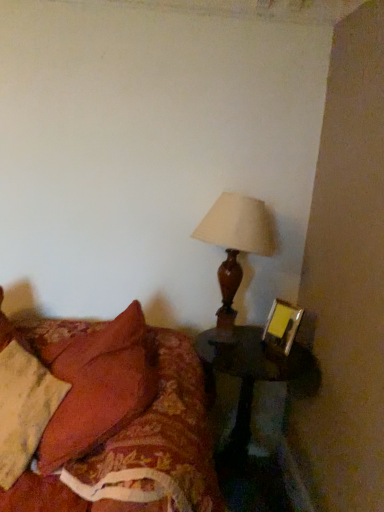
The width and height of the screenshot is (384, 512). In order to click on floral fabric bed at lower left in this screenshot , I will do `click(103, 419)`.

What do you see at coordinates (103, 419) in the screenshot?
I see `floral fabric bed at lower left` at bounding box center [103, 419].

Locate an element on the screen. The height and width of the screenshot is (512, 384). black wood side table at lower right is located at coordinates (252, 386).

Is floral fabric bed at lower left oriented away from velvet red pillow at lower left?

That's right, floral fabric bed at lower left is facing away from velvet red pillow at lower left.

Is floral fabric bed at lower left thinner than velvet red pillow at lower left?

In fact, floral fabric bed at lower left might be wider than velvet red pillow at lower left.

Is floral fabric bed at lower left spatially inside velvet red pillow at lower left, or outside of it?

floral fabric bed at lower left is located beyond the bounds of velvet red pillow at lower left.

Is floral fabric bed at lower left behind velvet red pillow at lower left?

No, the depth of floral fabric bed at lower left is less than that of velvet red pillow at lower left.

Considering the relative positions of velvet red pillow at lower left and matte brown lamp at upper right in the image provided, is velvet red pillow at lower left to the left or to the right of matte brown lamp at upper right?

Clearly, velvet red pillow at lower left is on the left of matte brown lamp at upper right in the image.

From the picture: From a real-world perspective, is velvet red pillow at lower left physically located above or below matte brown lamp at upper right?

velvet red pillow at lower left is situated lower than matte brown lamp at upper right in the real world.

Do you think velvet red pillow at lower left is within matte brown lamp at upper right, or outside of it?

The correct answer is: outside.

Which is behind, velvet red pillow at lower left or matte brown lamp at upper right?

matte brown lamp at upper right is further from the camera.

Which is more to the right, matte brown lamp at upper right or floral fabric bed at lower left?

Positioned to the right is matte brown lamp at upper right.

Which of these two, matte brown lamp at upper right or floral fabric bed at lower left, stands shorter?

Standing shorter between the two is floral fabric bed at lower left.

Does matte brown lamp at upper right have a smaller size compared to floral fabric bed at lower left?

Yes, matte brown lamp at upper right is smaller than floral fabric bed at lower left.

From the image's perspective, between matte brown lamp at upper right and floral fabric bed at lower left, which one is located above?

matte brown lamp at upper right, from the image's perspective.

Is floral fabric bed at lower left in contact with matte brown lamp at upper right?

No, floral fabric bed at lower left is not beside matte brown lamp at upper right.

From the image's perspective, is floral fabric bed at lower left over matte brown lamp at upper right?

No, from the image's perspective, floral fabric bed at lower left is not on top of matte brown lamp at upper right.

Is floral fabric bed at lower left wider than matte brown lamp at upper right?

Indeed, floral fabric bed at lower left has a greater width compared to matte brown lamp at upper right.

From a real-world perspective, which is physically above, floral fabric bed at lower left or matte brown lamp at upper right?

In real-world perspective, matte brown lamp at upper right is above.

Considering the relative sizes of floral fabric bed at lower left and black wood side table at lower right in the image provided, is floral fabric bed at lower left smaller than black wood side table at lower right?

Incorrect, floral fabric bed at lower left is not smaller in size than black wood side table at lower right.

Is floral fabric bed at lower left oriented away from black wood side table at lower right?

That's right, floral fabric bed at lower left is facing away from black wood side table at lower right.

Which is closer, [184,479] or [242,356]?

Positioned in front is point [184,479].

From the image's perspective, between floral fabric bed at lower left and black wood side table at lower right, who is located below?

black wood side table at lower right is shown below in the image.

From the image's perspective, is velvet red pillow at lower left located above or below matte gold picture frame at right?

Clearly, from the image's perspective, velvet red pillow at lower left is below matte gold picture frame at right.

From a real-world perspective, is velvet red pillow at lower left physically located above or below matte gold picture frame at right?

velvet red pillow at lower left is situated lower than matte gold picture frame at right in the real world.

Considering the relative sizes of velvet red pillow at lower left and matte gold picture frame at right in the image provided, is velvet red pillow at lower left shorter than matte gold picture frame at right?

In fact, velvet red pillow at lower left may be taller than matte gold picture frame at right.

Measure the distance from velvet red pillow at lower left to matte gold picture frame at right.

37.42 inches.

Is the surface of black wood side table at lower right in direct contact with matte brown lamp at upper right?

There is a gap between black wood side table at lower right and matte brown lamp at upper right.

From the image's perspective, which is above, black wood side table at lower right or matte brown lamp at upper right?

From the image's view, matte brown lamp at upper right is above.

Looking at this image, between black wood side table at lower right and matte brown lamp at upper right, which one is positioned behind?

matte brown lamp at upper right is more distant.

Does point (283, 422) appear closer or farther from the camera than point (221, 313)?

Point (283, 422).

In order to click on pillow beneath the floral fabric bed at lower left (from a real-world perspective) in this screenshot , I will do `click(24, 408)`.

The height and width of the screenshot is (512, 384). I want to click on lamp located above the velvet red pillow at lower left (from the image's perspective), so click(x=235, y=248).

Based on their spatial positions, is matte gold picture frame at right or floral fabric bed at lower left further from black wood side table at lower right?

floral fabric bed at lower left is positioned further to the anchor black wood side table at lower right.

Looking at the image, which one is located closer to black wood side table at lower right, floral fabric bed at lower left or matte brown lamp at upper right?

The object closer to black wood side table at lower right is matte brown lamp at upper right.

Based on their spatial positions, is black wood side table at lower right or matte gold picture frame at right further from velvet red pillow at lower left?

matte gold picture frame at right lies further to velvet red pillow at lower left than the other object.

Based on their spatial positions, is floral fabric bed at lower left or matte brown lamp at upper right closer to matte gold picture frame at right?

Based on the image, matte brown lamp at upper right appears to be nearer to matte gold picture frame at right.

Based on the photo, which object lies further to the anchor point black wood side table at lower right, floral fabric bed at lower left or velvet red pillow at lower left?

velvet red pillow at lower left is further to black wood side table at lower right.

From the picture: Looking at the image, which one is located further to black wood side table at lower right, matte gold picture frame at right or velvet red pillow at lower left?

velvet red pillow at lower left is positioned further to the anchor black wood side table at lower right.

Estimate the real-world distances between objects in this image. Which object is closer to velvet red pillow at lower left, black wood side table at lower right or matte brown lamp at upper right?

black wood side table at lower right is closer to velvet red pillow at lower left.

When comparing their distances from matte brown lamp at upper right, does velvet red pillow at lower left or matte gold picture frame at right seem closer?

Among the two, matte gold picture frame at right is located nearer to matte brown lamp at upper right.

Locate an element on the screen. table between floral fabric bed at lower left and matte gold picture frame at right from left to right is located at coordinates point(252,386).

The height and width of the screenshot is (512, 384). In order to click on lamp between velvet red pillow at lower left and black wood side table at lower right from left to right in this screenshot , I will do `click(235, 248)`.

Locate an element on the screen. This screenshot has height=512, width=384. lamp located between floral fabric bed at lower left and matte gold picture frame at right in the left-right direction is located at coordinates (235, 248).

I want to click on furniture located between velvet red pillow at lower left and matte brown lamp at upper right in the left-right direction, so click(103, 419).